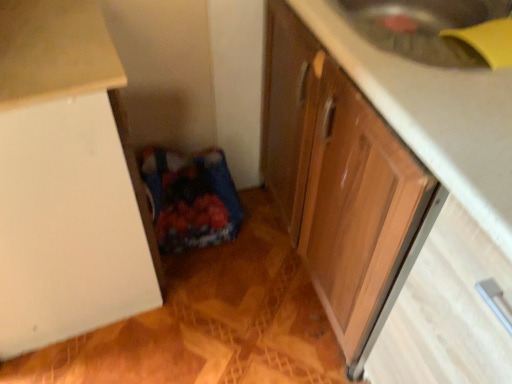
Question: Can you confirm if white matte cabinet at left, the second cabinetry in the right-to-left sequence, is bigger than wooden cabinet at lower right, acting as the 2th cabinetry starting from the left?

Choices:
 (A) no
 (B) yes

Answer: (A)

Question: From a real-world perspective, is white matte cabinet at left, the second cabinetry in the right-to-left sequence, located beneath wooden cabinet at lower right, acting as the 2th cabinetry starting from the left?

Choices:
 (A) yes
 (B) no

Answer: (A)

Question: Is white matte cabinet at left, the second cabinetry in the right-to-left sequence, turned away from wooden cabinet at lower right, acting as the 1th cabinetry starting from the right?

Choices:
 (A) no
 (B) yes

Answer: (A)

Question: Is white matte cabinet at left, which is the 1th cabinetry from left to right, outside of wooden cabinet at lower right, acting as the 1th cabinetry starting from the right?

Choices:
 (A) yes
 (B) no

Answer: (A)

Question: Is white matte cabinet at left, which is the 1th cabinetry from left to right, facing towards wooden cabinet at lower right, acting as the 2th cabinetry starting from the left?

Choices:
 (A) yes
 (B) no

Answer: (A)

Question: Does white matte cabinet at left, the second cabinetry in the right-to-left sequence, have a greater height compared to wooden cabinet at lower right, acting as the 1th cabinetry starting from the right?

Choices:
 (A) yes
 (B) no

Answer: (A)

Question: Is wooden cabinet at lower right, acting as the 2th cabinetry starting from the left, at the right side of white matte cabinet at left, which is the 1th cabinetry from left to right?

Choices:
 (A) no
 (B) yes

Answer: (B)

Question: Can you confirm if wooden cabinet at lower right, acting as the 1th cabinetry starting from the right, is wider than white matte cabinet at left, the second cabinetry in the right-to-left sequence?

Choices:
 (A) yes
 (B) no

Answer: (A)

Question: From a real-world perspective, is wooden cabinet at lower right, acting as the 2th cabinetry starting from the left, on white matte cabinet at left, the second cabinetry in the right-to-left sequence?

Choices:
 (A) no
 (B) yes

Answer: (B)

Question: Is wooden cabinet at lower right, acting as the 1th cabinetry starting from the right, far from white matte cabinet at left, the second cabinetry in the right-to-left sequence?

Choices:
 (A) no
 (B) yes

Answer: (A)

Question: From a real-world perspective, is wooden cabinet at lower right, acting as the 1th cabinetry starting from the right, beneath white matte cabinet at left, which is the 1th cabinetry from left to right?

Choices:
 (A) no
 (B) yes

Answer: (A)

Question: Is the surface of wooden cabinet at lower right, acting as the 2th cabinetry starting from the left, in direct contact with white matte cabinet at left, which is the 1th cabinetry from left to right?

Choices:
 (A) yes
 (B) no

Answer: (B)

Question: Is wooden drawer at lower right shorter than wooden cabinet at lower right, acting as the 2th cabinetry starting from the left?

Choices:
 (A) no
 (B) yes

Answer: (A)